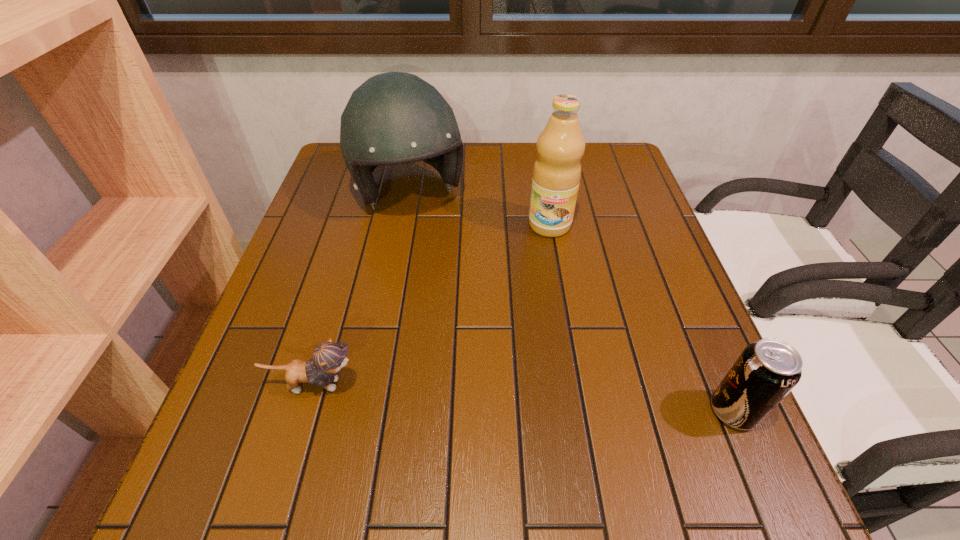
The width and height of the screenshot is (960, 540). Identify the location of the shortest object. (328, 358).

This screenshot has height=540, width=960. I want to click on soda can, so click(766, 371).

Locate an element on the screen. The height and width of the screenshot is (540, 960). the third tallest object is located at coordinates (766, 371).

The image size is (960, 540). I want to click on football helmet, so click(393, 118).

Locate an element on the screen. The width and height of the screenshot is (960, 540). the second object from right to left is located at coordinates coord(560,146).

Where is `vacant region located 0.170m on the front-facing side of the shortest object`? vacant region located 0.170m on the front-facing side of the shortest object is located at coordinates (452, 384).

Identify the location of free space located on the back of the soda can. The width and height of the screenshot is (960, 540). (685, 299).

Identify the location of vacant space located at the face opening of the football helmet. This screenshot has height=540, width=960. (469, 329).

You are a GUI agent. You are given a task and a screenshot of the screen. Output one action in this format:
    pyautogui.click(x=<x>, y=<y>)
    Task: Click on the blank area located 0.090m at the face opening of the football helmet
    
    Given the screenshot: What is the action you would take?
    pyautogui.click(x=435, y=252)

At what (x,y) coordinates should I click in order to perform the action: click on free space located 0.360m at the face opening of the football helmet. Please return your answer as a coordinate pair (x, y). Looking at the image, I should click on (473, 337).